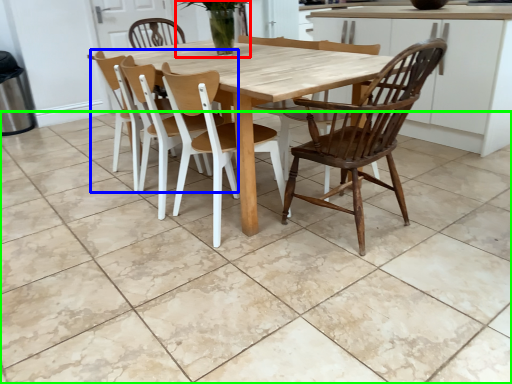
Question: Based on their relative distances, which object is farther from plant (highlighted by a red box)? Choose from chair (highlighted by a blue box) and tile (highlighted by a green box).

Choices:
 (A) chair
 (B) tile

Answer: (B)